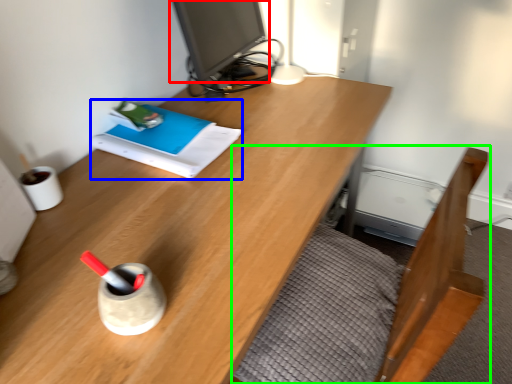
Question: Which object is positioned farthest from computer monitor (highlighted by a red box)? Select from book (highlighted by a blue box) and bed frame (highlighted by a green box).

Choices:
 (A) book
 (B) bed frame

Answer: (B)